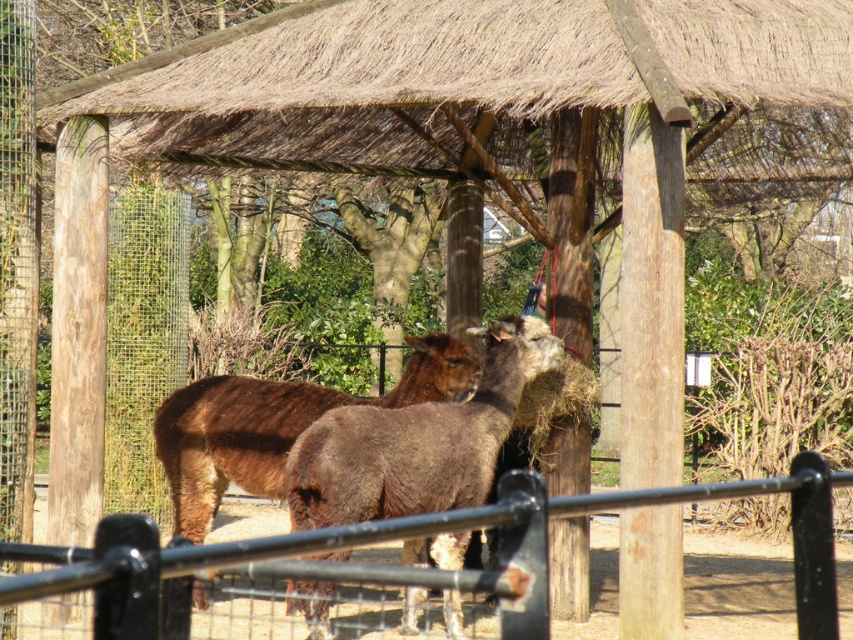
You are a zookeeper trying to feed the alpacas. You are standing behind the black metal fence at lower center and want to reach the brown woolly alpaca at center. Which direction should you move to get closer to the alpaca?

The black metal fence at lower center is to the right of the brown woolly alpaca at center, so you should move to the left to get closer to the brown woolly alpaca at center.

From the picture: You are standing in the middle of the enclosure and want to approach the black metal fence at lower center. What direction should you move in to reach it?

The black metal fence at lower center is located at point (x=386, y=564), so you should move towards the lower center direction to reach it.

You are standing at the entrance of the enclosure and notice two points marked on the ground. The first point is at coordinate point (312,586) and the second is at point (200,596). Which point is closer to you?

Point (312,586) is in front of point (200,596), so the first point is closer to you.